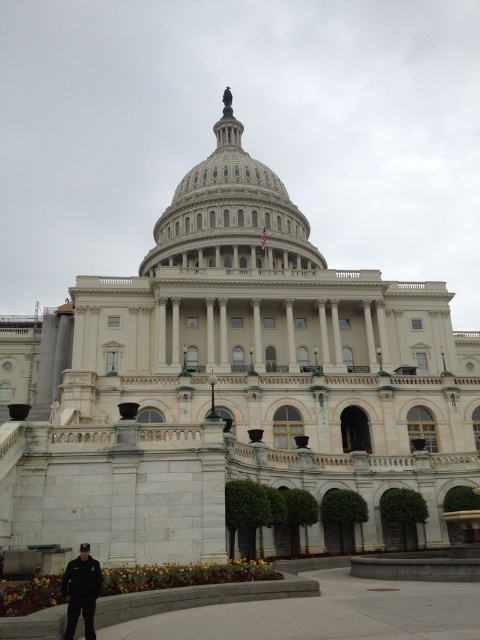
Question: Which of the following is the closest to the observer?

Choices:
 (A) white marble dome at center
 (B) dark blue uniform at lower left

Answer: (B)

Question: Does white marble dome at center appear over dark blue uniform at lower left?

Choices:
 (A) yes
 (B) no

Answer: (A)

Question: Is white marble dome at center positioned behind dark blue uniform at lower left?

Choices:
 (A) no
 (B) yes

Answer: (B)

Question: Which of the following is the farthest from the observer?

Choices:
 (A) white marble dome at center
 (B) dark blue uniform at lower left

Answer: (A)

Question: Does white marble dome at center have a greater width compared to dark blue uniform at lower left?

Choices:
 (A) no
 (B) yes

Answer: (B)